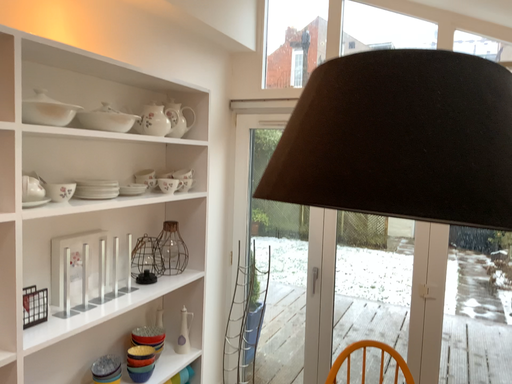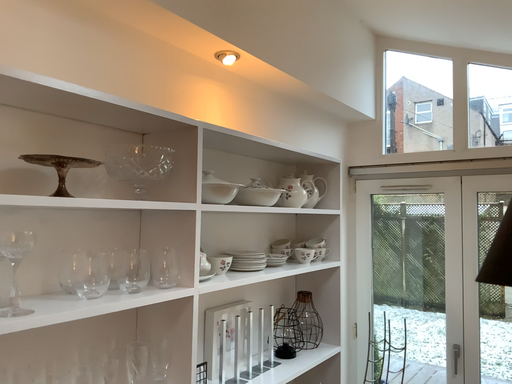
Question: How did the camera likely rotate when shooting the video?

Choices:
 (A) rotated upward
 (B) rotated downward

Answer: (A)